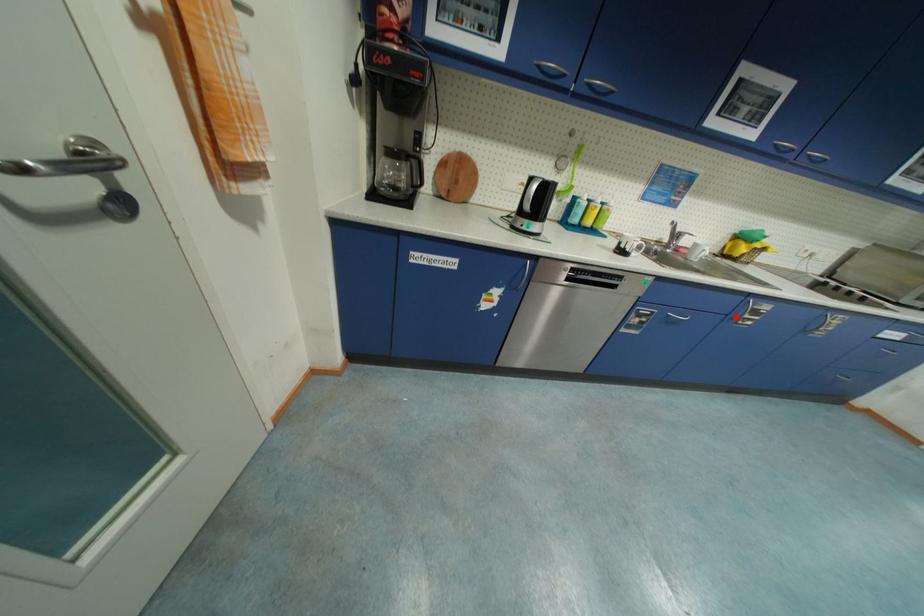
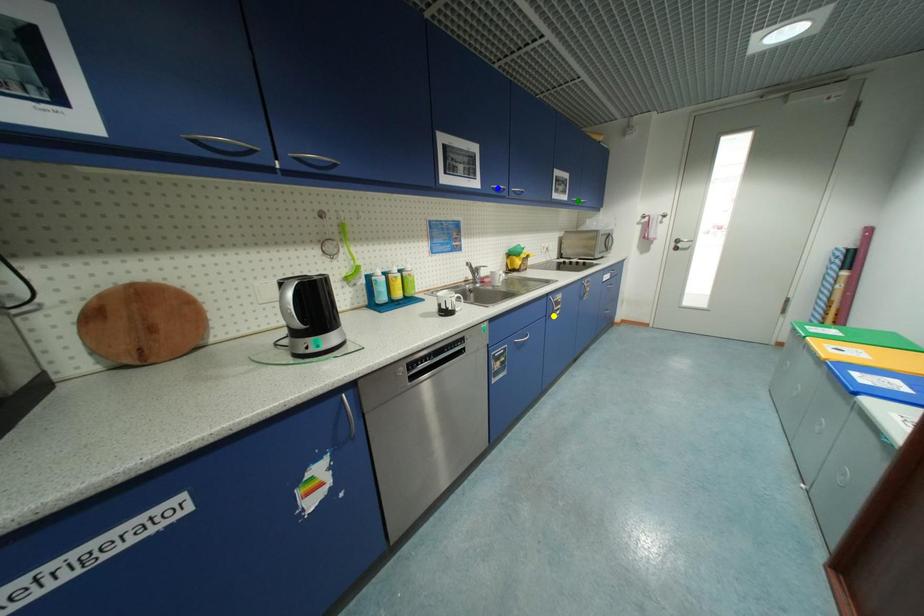
Question: I am providing you with two images of the same scene from different viewpoints. A red point is marked on the first image. You are given multiple points on the second image. Can you choose the point in image 2 that corresponds to the point in image 1?

Choices:
 (A) green point
 (B) blue point
 (C) yellow point

Answer: (C)